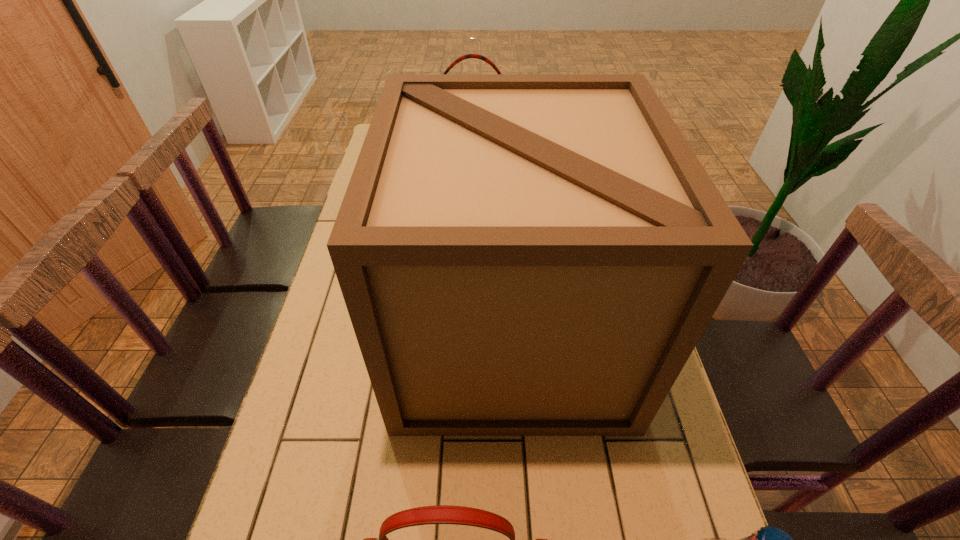
The width and height of the screenshot is (960, 540). Find the location of `object that is the second closest to the alcohol`. object that is the second closest to the alcohol is located at coordinates (520, 254).

Identify which object is located as the second nearest to the alcohol. Please provide its 2D coordinates. Your answer should be formatted as a tuple, i.e. [(x, y)], where the tuple contains the x and y coordinates of a point satisfying the conditions above.

[(520, 254)]